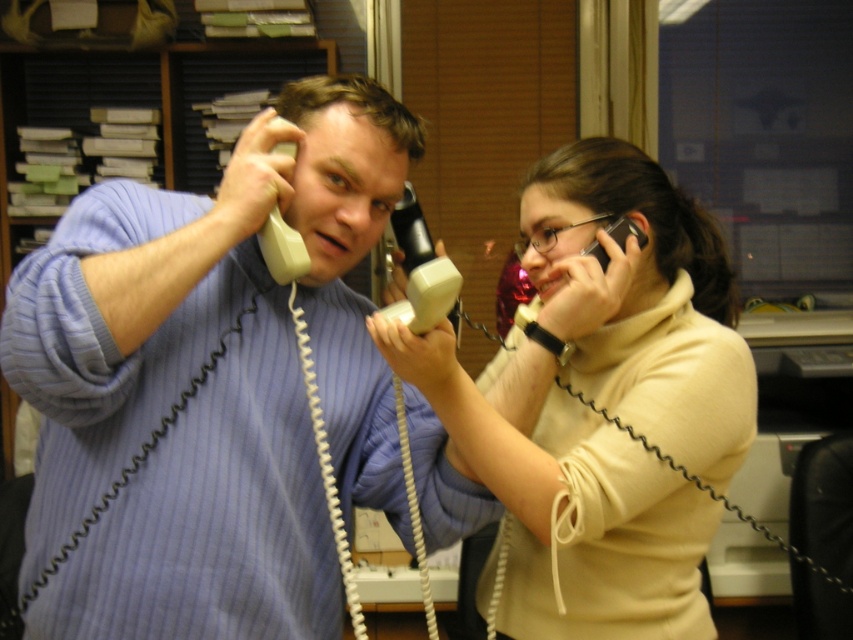
Measure the distance between point (456,305) and camera.

Point (456,305) is 1.18 meters from camera.

Is white plastic phone at center above black plastic phone at upper right?

No, white plastic phone at center is not above black plastic phone at upper right.

Which is in front, point (397, 241) or point (614, 221)?

Positioned in front is point (614, 221).

Locate an element on the screen. The width and height of the screenshot is (853, 640). white plastic phone at center is located at coordinates (424, 268).

Does matte beige sweater at center have a greater height compared to black plastic phone at upper right?

Yes, matte beige sweater at center is taller than black plastic phone at upper right.

Can you confirm if matte beige sweater at center is bigger than black plastic phone at upper right?

Indeed, matte beige sweater at center has a larger size compared to black plastic phone at upper right.

Which is in front, point (416, 358) or point (622, 227)?

Point (416, 358) is in front.

This screenshot has width=853, height=640. Identify the location of matte beige sweater at center. (572, 509).

Does matte blue sweater at center appear under black plastic phone at upper right?

Indeed, matte blue sweater at center is positioned under black plastic phone at upper right.

Does matte blue sweater at center have a lesser height compared to black plastic phone at upper right?

In fact, matte blue sweater at center may be taller than black plastic phone at upper right.

The height and width of the screenshot is (640, 853). Describe the element at coordinates (210, 385) in the screenshot. I see `matte blue sweater at center` at that location.

Find the location of a particular element. Image resolution: width=853 pixels, height=640 pixels. matte blue sweater at center is located at coordinates (210, 385).